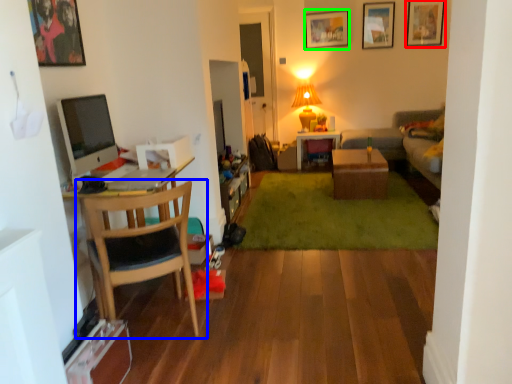
Question: Which is nearer to the picture frame (highlighted by a red box)? chair (highlighted by a blue box) or picture frame (highlighted by a green box).

Choices:
 (A) chair
 (B) picture frame

Answer: (B)